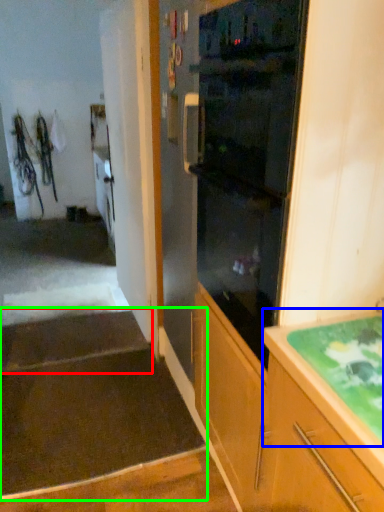
Question: Which object is positioned closest to stairwell (highlighted by a red box)? Select from countertop (highlighted by a blue box) and stairwell (highlighted by a green box).

Choices:
 (A) countertop
 (B) stairwell

Answer: (B)